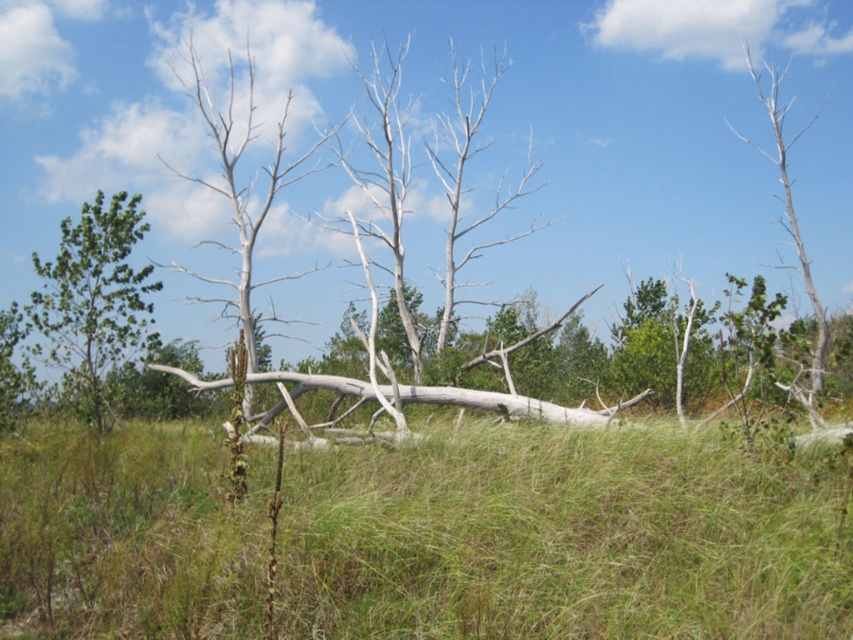
Can you confirm if green leafy tree at left is bigger than gray bark tree at upper right?

Actually, green leafy tree at left might be smaller than gray bark tree at upper right.

The width and height of the screenshot is (853, 640). What are the coordinates of `green leafy tree at left` in the screenshot? It's located at (93, 298).

Image resolution: width=853 pixels, height=640 pixels. I want to click on green leafy tree at left, so click(93, 298).

Find the location of a particular element. Image resolution: width=853 pixels, height=640 pixels. green grassy at center is located at coordinates (563, 538).

Which of these two, green grassy at center or gray bark tree at upper right, stands shorter?

With less height is green grassy at center.

Who is more distant from viewer, (708, 454) or (811, 420)?

The point (811, 420) is behind.

Where is `green grassy at center`? green grassy at center is located at coordinates (563, 538).

The height and width of the screenshot is (640, 853). In order to click on green grassy at center in this screenshot , I will do coord(563,538).

Does green grassy at center have a smaller size compared to green leafy tree at left?

Yes, green grassy at center is smaller than green leafy tree at left.

Is point (810, 499) behind point (86, 412)?

No, it is not.

At what (x,y) coordinates should I click in order to perform the action: click on green grassy at center. Please return your answer as a coordinate pair (x, y). The width and height of the screenshot is (853, 640). Looking at the image, I should click on (563, 538).